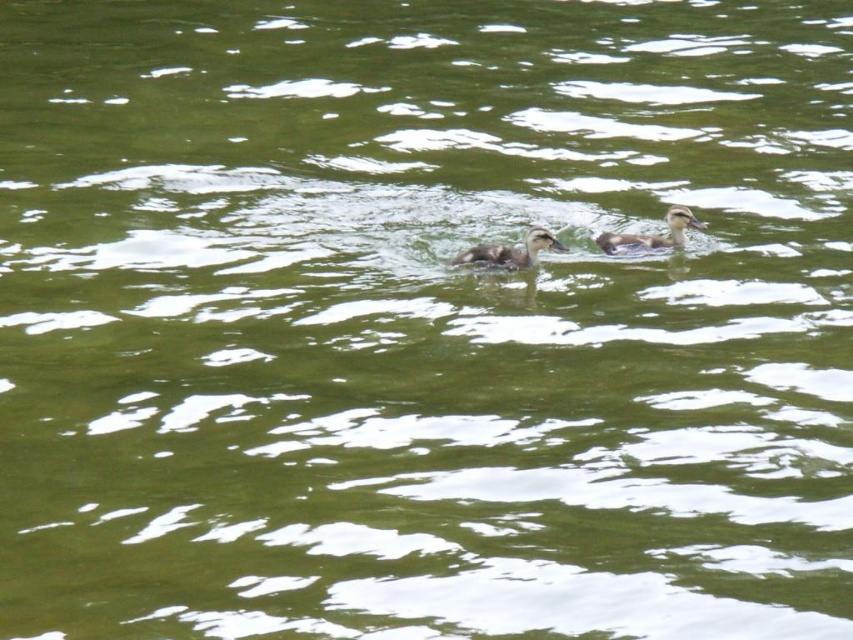
Question: Can you confirm if brown fuzzy duckling at center is wider than brown speckled duckling at upper center?

Choices:
 (A) yes
 (B) no

Answer: (A)

Question: Which point appears closest to the camera in this image?

Choices:
 (A) (514, 253)
 (B) (611, 246)

Answer: (A)

Question: Among these points, which one is farthest from the camera?

Choices:
 (A) [x=613, y=244]
 (B) [x=519, y=253]

Answer: (A)

Question: Is brown fuzzy duckling at center smaller than brown speckled duckling at upper center?

Choices:
 (A) yes
 (B) no

Answer: (B)

Question: Can you confirm if brown fuzzy duckling at center is positioned below brown speckled duckling at upper center?

Choices:
 (A) no
 (B) yes

Answer: (B)

Question: Which of the following is the closest to the observer?

Choices:
 (A) brown speckled duckling at upper center
 (B) brown fuzzy duckling at center

Answer: (B)